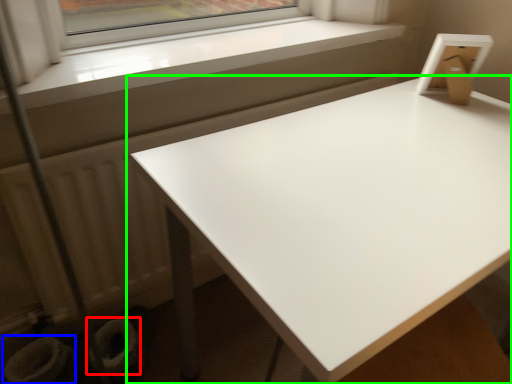
Question: Based on their relative distances, which object is farther from toilet bowl (highlighted by a red box)? Choose from toilet bowl (highlighted by a blue box) and table (highlighted by a green box).

Choices:
 (A) toilet bowl
 (B) table

Answer: (B)